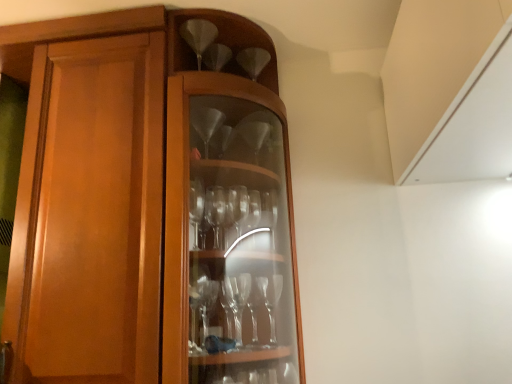
Image resolution: width=512 pixels, height=384 pixels. What do you see at coordinates (198, 36) in the screenshot? I see `clear glass wine glass at upper center` at bounding box center [198, 36].

Locate an element on the screen. clear glass wine glass at upper center is located at coordinates (198, 36).

At what (x,y) coordinates should I click in order to perform the action: click on clear glass wine glass at upper center. Please return your answer as a coordinate pair (x, y). Looking at the image, I should click on (198, 36).